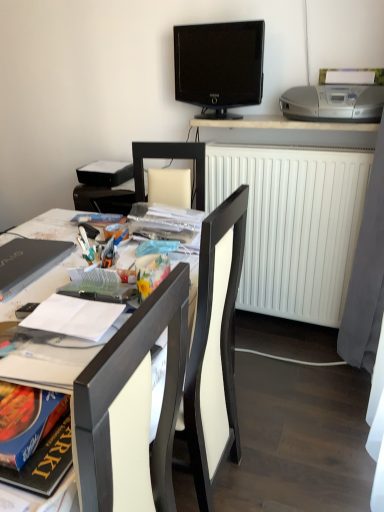
Question: Would you say silver plastic printer at upper right contains hardcover book at center-left?

Choices:
 (A) no
 (B) yes

Answer: (A)

Question: Does silver plastic printer at upper right have a lesser height compared to hardcover book at center-left?

Choices:
 (A) no
 (B) yes

Answer: (A)

Question: Is silver plastic printer at upper right not close to hardcover book at center-left?

Choices:
 (A) yes
 (B) no

Answer: (A)

Question: Does silver plastic printer at upper right turn towards hardcover book at center-left?

Choices:
 (A) yes
 (B) no

Answer: (B)

Question: Is silver plastic printer at upper right to the right of hardcover book at center-left from the viewer's perspective?

Choices:
 (A) yes
 (B) no

Answer: (A)

Question: From a real-world perspective, is hardcover book at center-left above or below white glossy desk at upper center, acting as the first desk starting from the back?

Choices:
 (A) above
 (B) below

Answer: (B)

Question: Would you say hardcover book at center-left is to the left or to the right of white glossy desk at upper center, which is counted as the second desk, starting from the front, in the picture?

Choices:
 (A) right
 (B) left

Answer: (B)

Question: Considering their positions, is hardcover book at center-left located in front of or behind white glossy desk at upper center, which is the 1th desk in top-to-bottom order?

Choices:
 (A) behind
 (B) front

Answer: (B)

Question: Is point (119, 301) positioned closer to the camera than point (311, 137)?

Choices:
 (A) farther
 (B) closer

Answer: (B)

Question: From the image's perspective, is black glossy tv at upper center positioned above or below silver plastic printer at upper right?

Choices:
 (A) above
 (B) below

Answer: (A)

Question: Is black glossy tv at upper center taller or shorter than silver plastic printer at upper right?

Choices:
 (A) short
 (B) tall

Answer: (B)

Question: Considering the positions of black glossy tv at upper center and silver plastic printer at upper right in the image, is black glossy tv at upper center bigger or smaller than silver plastic printer at upper right?

Choices:
 (A) small
 (B) big

Answer: (B)

Question: In terms of width, does black glossy tv at upper center look wider or thinner when compared to silver plastic printer at upper right?

Choices:
 (A) thin
 (B) wide

Answer: (A)

Question: Relative to matte black laptop at left, is black glossy tv at upper center in front or behind?

Choices:
 (A) front
 (B) behind

Answer: (B)

Question: Is black glossy tv at upper center inside the boundaries of matte black laptop at left, or outside?

Choices:
 (A) outside
 (B) inside

Answer: (A)